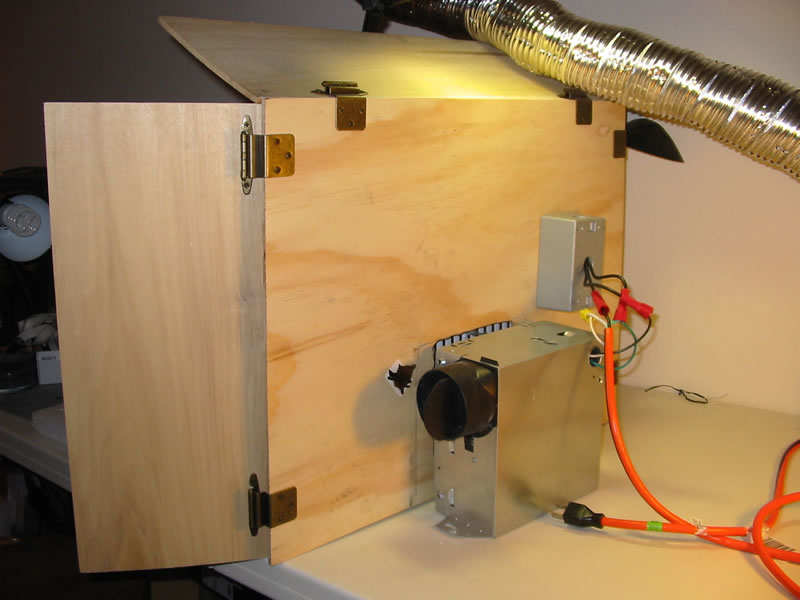
At what (x,y) coordinates should I click in order to perform the action: click on wooden sides. Please return your answer as a coordinate pair (x, y). Looking at the image, I should click on (180, 279), (324, 278), (244, 43).